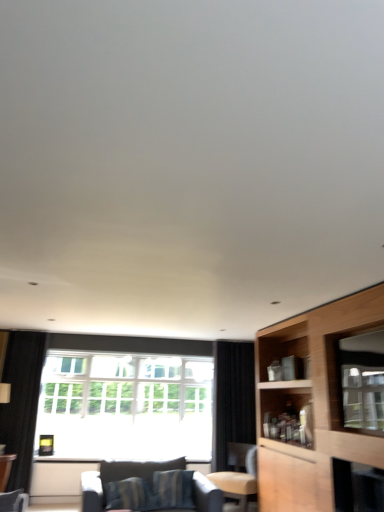
What do you see at coordinates (321, 404) in the screenshot? Image resolution: width=384 pixels, height=512 pixels. I see `wooden cabinet at right` at bounding box center [321, 404].

You are a GUI agent. You are given a task and a screenshot of the screen. Output one action in this format:
    pyautogui.click(x=<x>, y=<y>)
    Task: Click on the wooden table at lower left
    The height and width of the screenshot is (512, 384).
    Given the screenshot: What is the action you would take?
    pyautogui.click(x=5, y=469)

Identify the location of black fabric curtain at left, the 1th curtain viewed from the left. The image size is (384, 512). (22, 402).

This screenshot has width=384, height=512. Describe the element at coordinates (22, 402) in the screenshot. I see `black fabric curtain at left, the 2th curtain from the right` at that location.

The height and width of the screenshot is (512, 384). What do you see at coordinates (127, 399) in the screenshot?
I see `clear glass window at center` at bounding box center [127, 399].

This screenshot has width=384, height=512. What are the coordinates of `wooden cabinet at right` in the screenshot? It's located at (321, 404).

Does wooden table at lower left turn towards striped fabric couch at lower center?

No.

Does wooden table at lower left lie behind striped fabric couch at lower center?

Yes.

Which of these two, wooden table at lower left or striped fabric couch at lower center, is thinner?

wooden table at lower left is thinner.

Where is `studio couch lying on the right of wooden table at lower left`? studio couch lying on the right of wooden table at lower left is located at coordinates coord(149,488).

Does transparent glass window screen at right appear on the left side of wooden table at lower left?

Incorrect, transparent glass window screen at right is not on the left side of wooden table at lower left.

Is transparent glass window screen at right thinner than wooden table at lower left?

Indeed, transparent glass window screen at right has a lesser width compared to wooden table at lower left.

Is point (340, 426) closer or farther from the camera than point (8, 476)?

Point (340, 426) is closer to the camera than point (8, 476).

What's the angular difference between transparent glass window screen at right and wooden table at lower left's facing directions?

They differ by 178 degrees in their facing directions.

Could you tell me if wooden table at lower left is facing wooden cabinet at right?

No, wooden table at lower left does not turn towards wooden cabinet at right.

In terms of height, does wooden table at lower left look taller or shorter compared to wooden cabinet at right?

Considering their sizes, wooden table at lower left has less height than wooden cabinet at right.

Image resolution: width=384 pixels, height=512 pixels. What are the coordinates of `cabinetry in front of the wooden table at lower left` in the screenshot? It's located at (321, 404).

How many degrees apart are the facing directions of wooden table at lower left and wooden cabinet at right?

The angle between the facing direction of wooden table at lower left and the facing direction of wooden cabinet at right is 180 degrees.

You are a GUI agent. You are given a task and a screenshot of the screen. Output one action in this format:
    pyautogui.click(x=<x>, y=<y>)
    Task: Click on the window screen that appears on the right of striped fabric couch at lower center
    The image size is (384, 512).
    Given the screenshot: What is the action you would take?
    pos(357,381)

Which of these two, striped fabric couch at lower center or transparent glass window screen at right, is wider?

With larger width is striped fabric couch at lower center.

Consider the image. Is striped fabric couch at lower center further to camera compared to transparent glass window screen at right?

Yes, it is behind transparent glass window screen at right.

Can you tell me how much striped fabric couch at lower center and transparent glass window screen at right differ in facing direction?

The facing directions of striped fabric couch at lower center and transparent glass window screen at right are 93 degrees apart.

Which is more to the left, clear glass window at center or black fabric curtain at left, the 1th curtain viewed from the left?

black fabric curtain at left, the 1th curtain viewed from the left.

The height and width of the screenshot is (512, 384). Find the location of `curtain located above the clear glass window at center (from the image's perspective)`. curtain located above the clear glass window at center (from the image's perspective) is located at coordinates (22, 402).

Which object is further away from the camera, clear glass window at center or black fabric curtain at left, the 1th curtain viewed from the left?

clear glass window at center is further away from the camera.

You are a GUI agent. You are given a task and a screenshot of the screen. Output one action in this format:
    pyautogui.click(x=<x>, y=<y>)
    Task: Click on the curtain on the right of black fabric curtain at left, the 2th curtain from the right
    This screenshot has width=384, height=512.
    Given the screenshot: What is the action you would take?
    pyautogui.click(x=232, y=398)

Between point (232, 362) and point (18, 456), which one is positioned behind?

The point (232, 362) is more distant.

Is the surface of black fabric curtain at center, the first curtain when ordered from right to left, in direct contact with black fabric curtain at left, the 2th curtain from the right?

No, black fabric curtain at center, the first curtain when ordered from right to left, is not making contact with black fabric curtain at left, the 2th curtain from the right.

From the image's perspective, is black fabric curtain at center, the first curtain when ordered from right to left, located above or below black fabric curtain at left, the 2th curtain from the right?

From the image's perspective, black fabric curtain at center, the first curtain when ordered from right to left, appears below black fabric curtain at left, the 2th curtain from the right.

From the image's perspective, which one is positioned higher, light brown leather chair at center or wooden cabinet at right?

wooden cabinet at right appears higher in the image.

Is light brown leather chair at center bigger or smaller than wooden cabinet at right?

light brown leather chair at center is smaller than wooden cabinet at right.

Which of these two, light brown leather chair at center or wooden cabinet at right, is wider?

Wider between the two is light brown leather chair at center.

Considering the positions of objects light brown leather chair at center and wooden cabinet at right in the image provided, who is more to the right, light brown leather chair at center or wooden cabinet at right?

Positioned to the right is wooden cabinet at right.

Locate an element on the screen. This screenshot has width=384, height=512. table that appears below the striped fabric couch at lower center (from a real-world perspective) is located at coordinates (5, 469).

This screenshot has height=512, width=384. Identify the location of window screen that is on the right side of wooden table at lower left. (357, 381).

From the image, which object appears to be farther from black fabric curtain at left, the 2th curtain from the right, clear glass window at center or wooden table at lower left?

clear glass window at center lies further to black fabric curtain at left, the 2th curtain from the right, than the other object.

Looking at the image, which one is located closer to light brown leather chair at center, black fabric curtain at center, which ranks as the 2th curtain in left-to-right order, or clear glass window at center?

The object closer to light brown leather chair at center is black fabric curtain at center, which ranks as the 2th curtain in left-to-right order.

Which object lies nearer to the anchor point wooden cabinet at right, wooden table at lower left or black fabric curtain at left, the 1th curtain viewed from the left?

Among the two, black fabric curtain at left, the 1th curtain viewed from the left, is located nearer to wooden cabinet at right.

From the image, which object appears to be farther from black fabric curtain at center, which ranks as the 2th curtain in left-to-right order, wooden cabinet at right or striped fabric couch at lower center?

Based on the image, striped fabric couch at lower center appears to be further to black fabric curtain at center, which ranks as the 2th curtain in left-to-right order.

Which object lies nearer to the anchor point striped fabric couch at lower center, wooden table at lower left or wooden cabinet at right?

The object closer to striped fabric couch at lower center is wooden cabinet at right.

Based on the photo, based on their spatial positions, is wooden table at lower left or light brown leather chair at center closer to striped fabric couch at lower center?

light brown leather chair at center is positioned closer to the anchor striped fabric couch at lower center.

Considering their positions, is clear glass window at center positioned closer to black fabric curtain at center, which ranks as the 2th curtain in left-to-right order, than wooden cabinet at right?

Based on the image, clear glass window at center appears to be nearer to black fabric curtain at center, which ranks as the 2th curtain in left-to-right order.

When comparing their distances from clear glass window at center, does wooden cabinet at right or transparent glass window screen at right seem further?

transparent glass window screen at right is further to clear glass window at center.

Find the location of a particular element. This screenshot has height=512, width=384. chair positioned between wooden cabinet at right and clear glass window at center from near to far is located at coordinates (239, 474).

Where is `chair between clear glass window at center and black fabric curtain at center, which ranks as the 2th curtain in left-to-right order`? Image resolution: width=384 pixels, height=512 pixels. chair between clear glass window at center and black fabric curtain at center, which ranks as the 2th curtain in left-to-right order is located at coordinates (239, 474).

You are a GUI agent. You are given a task and a screenshot of the screen. Output one action in this format:
    pyautogui.click(x=<x>, y=<y>)
    Task: Click on the chair between striped fabric couch at lower center and clear glass window at center from front to back
    
    Given the screenshot: What is the action you would take?
    pyautogui.click(x=239, y=474)

The image size is (384, 512). Identify the location of studio couch between black fabric curtain at left, the 1th curtain viewed from the left, and light brown leather chair at center from left to right. (149, 488).